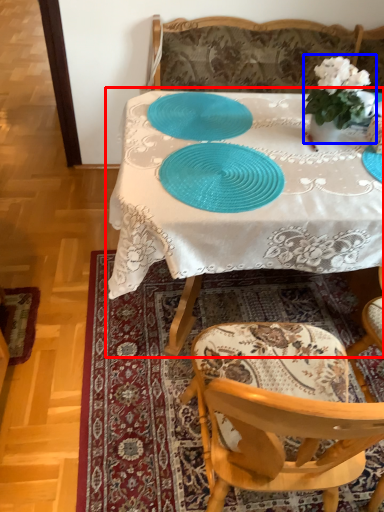
Question: Which point is closer to the camera, table (highlighted by a red box) or houseplant (highlighted by a blue box)?

Choices:
 (A) table
 (B) houseplant

Answer: (A)